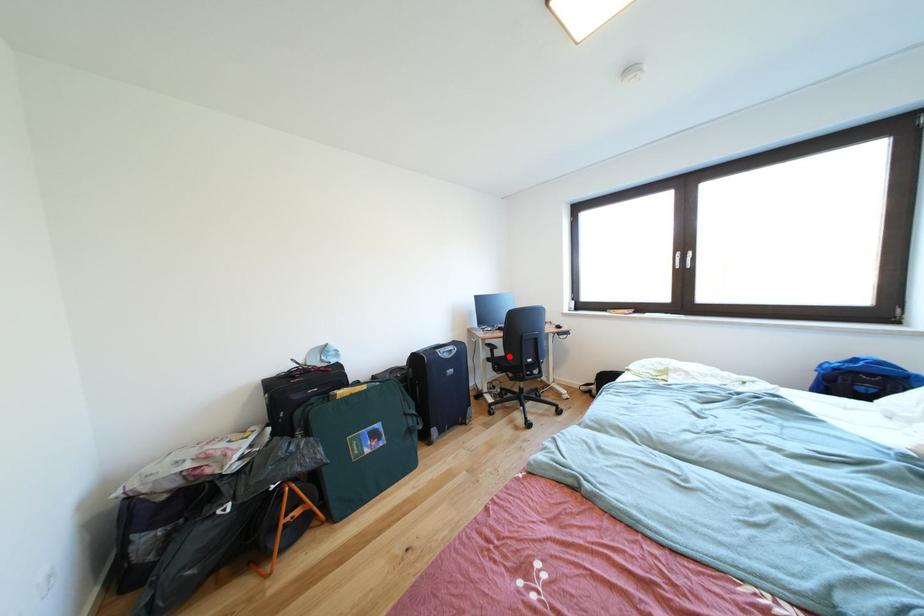
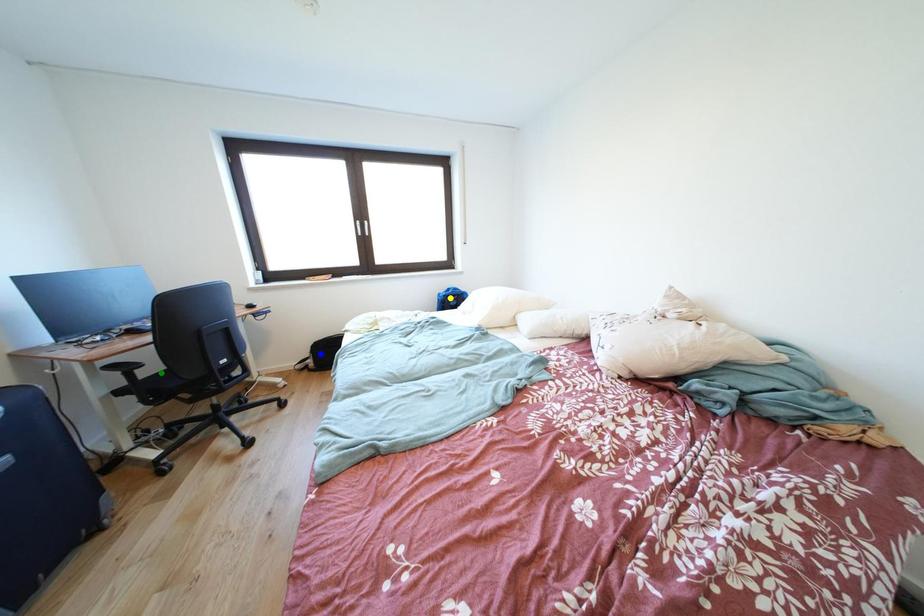
Question: I am providing you with two images of the same scene from different viewpoints. A red point is marked on the first image. You are given multiple points on the second image. Can you choose the point in image 2 that corresponds to the point in image 1?

Choices:
 (A) blue point
 (B) green point
 (C) yellow point

Answer: (B)